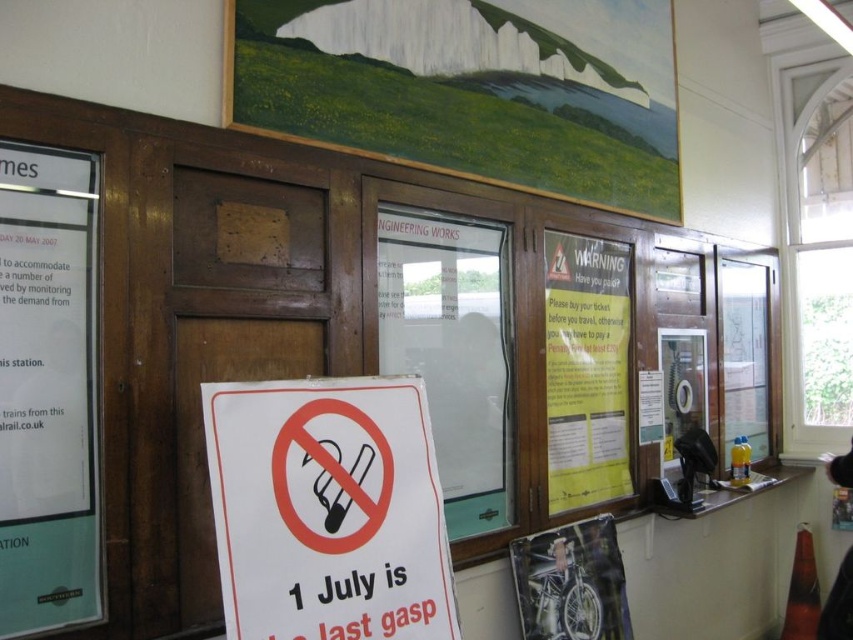
What do you see at coordinates (328, 509) in the screenshot?
I see `white paper sign at center` at bounding box center [328, 509].

Is point (236, 550) closer to camera compared to point (605, 368)?

Yes.

Image resolution: width=853 pixels, height=640 pixels. I want to click on white paper sign at center, so click(x=328, y=509).

Locate an element on the screen. The width and height of the screenshot is (853, 640). white paper sign at center is located at coordinates tap(328, 509).

Is point (347, 528) positioned in front of point (51, 417)?

No, it is behind (51, 417).

Is white paper sign at center below green paper poster at left?

Yes, white paper sign at center is below green paper poster at left.

Is point (325, 520) positioned after point (61, 301)?

That is True.

This screenshot has height=640, width=853. Find the location of `white paper sign at center`. white paper sign at center is located at coordinates (328, 509).

Can you confirm if green paper poster at left is positioned to the left of yellow paper poster at center?

Yes, green paper poster at left is to the left of yellow paper poster at center.

Between green paper poster at left and yellow paper poster at center, which one appears on the left side from the viewer's perspective?

green paper poster at left is more to the left.

Is point (67, 490) positioned in front of point (614, 305)?

That is True.

I want to click on green paper poster at left, so click(x=48, y=390).